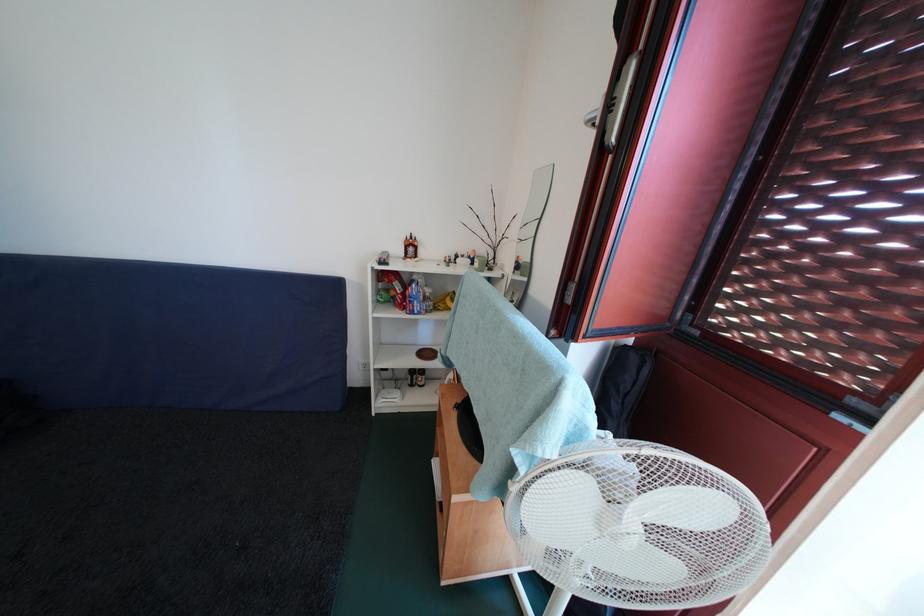
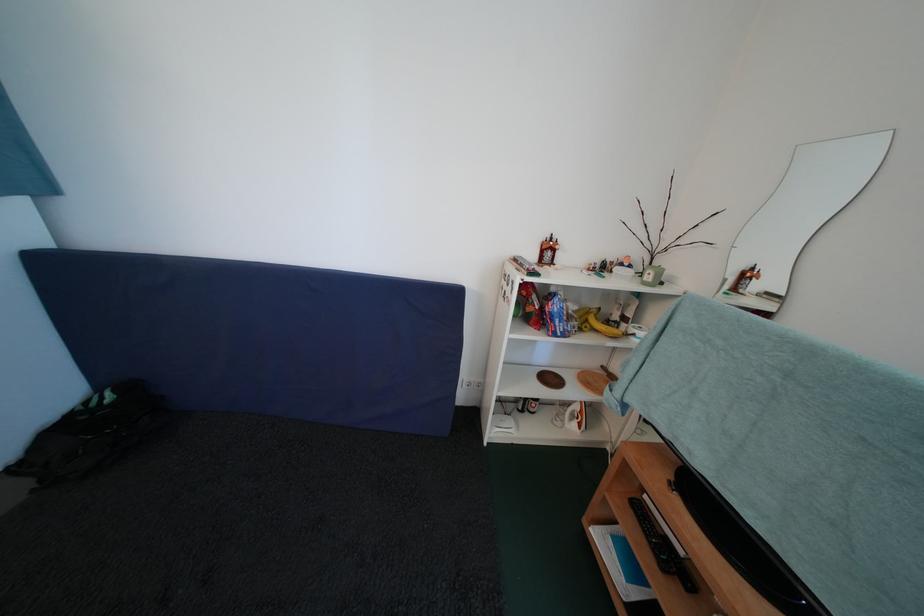
Question: How did the camera likely rotate?

Choices:
 (A) Left
 (B) Right
 (C) Up
 (D) Down

Answer: (A)